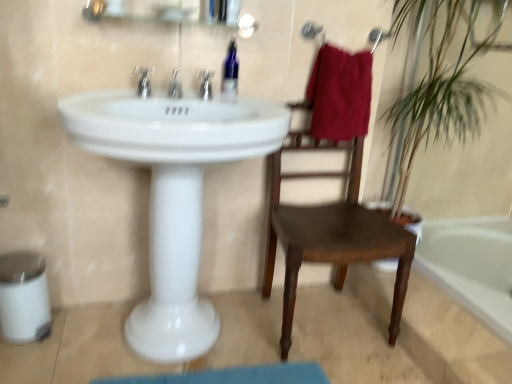
Locate an element on the screen. blue glossy bottle at upper center is located at coordinates (230, 74).

I want to click on burgundy cotton towel at upper right, so click(x=340, y=94).

Image resolution: width=512 pixels, height=384 pixels. Find the location of `white glossy bathtub at lower right`. white glossy bathtub at lower right is located at coordinates (472, 266).

What is the approximate height of green leafy plant at right?

It is 1.08 meters.

This screenshot has width=512, height=384. Describe the element at coordinates (331, 233) in the screenshot. I see `brown wooden chair at center` at that location.

Find the location of a particular element. The height and width of the screenshot is (384, 512). brown wooden chair at center is located at coordinates (331, 233).

What do you see at coordinates (144, 81) in the screenshot? I see `silver metallic faucet at upper center, acting as the 3th tap starting from the right` at bounding box center [144, 81].

Where is `blue glossy bottle at upper center`? blue glossy bottle at upper center is located at coordinates (230, 74).

From the image's perspective, is white glossy bathtub at lower right over brown wooden chair at center?

Actually, white glossy bathtub at lower right appears below brown wooden chair at center in the image.

What are the coordinates of `chair above the white glossy bathtub at lower right (from a real-world perspective)` in the screenshot? It's located at (331, 233).

Would you say white glossy bathtub at lower right contains brown wooden chair at center?

Actually, brown wooden chair at center is outside white glossy bathtub at lower right.

Looking at this image, based on their sizes in the image, would you say white glossy bathtub at lower right is bigger or smaller than brown wooden chair at center?

white glossy bathtub at lower right is smaller than brown wooden chair at center.

Considering the sizes of objects white glossy sink at center and metallic glass medicine cabinet at upper center in the image provided, who is thinner, white glossy sink at center or metallic glass medicine cabinet at upper center?

metallic glass medicine cabinet at upper center is thinner.

Is white glossy sink at center taller or shorter than metallic glass medicine cabinet at upper center?

In the image, white glossy sink at center appears to be taller than metallic glass medicine cabinet at upper center.

From the image's perspective, between white glossy sink at center and metallic glass medicine cabinet at upper center, which one is located above?

From the image's view, metallic glass medicine cabinet at upper center is above.

At what (x,y) coordinates should I click in order to perform the action: click on medicine cabinet on the left of white glossy sink at center. Please return your answer as a coordinate pair (x, y). This screenshot has width=512, height=384. Looking at the image, I should click on [x=166, y=10].

Is point (492, 329) positioned behind point (236, 3)?

Yes, point (492, 329) is farther from viewer.

Who is smaller, white glossy bathtub at lower right or metallic glass medicine cabinet at upper center?

metallic glass medicine cabinet at upper center is smaller.

Is white glossy bathtub at lower right aimed at metallic glass medicine cabinet at upper center?

No, white glossy bathtub at lower right is not turned towards metallic glass medicine cabinet at upper center.

What's the angular difference between white glossy bathtub at lower right and metallic glass medicine cabinet at upper center's facing directions?

The angular difference between white glossy bathtub at lower right and metallic glass medicine cabinet at upper center is 89.4 degrees.

At what (x,y) coordinates should I click in order to perform the action: click on beach towel behind the green leafy plant at right. Please return your answer as a coordinate pair (x, y). The width and height of the screenshot is (512, 384). Looking at the image, I should click on (340, 94).

From a real-world perspective, is green leafy plant at right positioned above or below burgundy cotton towel at upper right?

green leafy plant at right is situated lower than burgundy cotton towel at upper right in the real world.

Would you say green leafy plant at right is inside or outside burgundy cotton towel at upper right?

green leafy plant at right lies outside burgundy cotton towel at upper right.

From the image's perspective, is green leafy plant at right above burgundy cotton towel at upper right?

No.

From a real-world perspective, count 1st taps upward from the green leafy plant at right and point to it. Please provide its 2D coordinates.

[(175, 87)]

From the image's perspective, is green leafy plant at right under silver metallic tap at center, positioned as the second tap in right-to-left order?

Yes, from the image's perspective, green leafy plant at right is beneath silver metallic tap at center, positioned as the second tap in right-to-left order.

Consider the image. Does green leafy plant at right have a greater height compared to silver metallic tap at center, positioned as the second tap in right-to-left order?

Yes.

Does point (322, 95) lie in front of point (177, 83)?

That is False.

You are a GUI agent. You are given a task and a screenshot of the screen. Output one action in this format:
    pyautogui.click(x=<x>, y=<y>)
    Task: Click on the beach towel behind the silver metallic tap at center, the 2th tap positioned from the left
    This screenshot has height=384, width=512.
    Given the screenshot: What is the action you would take?
    pyautogui.click(x=340, y=94)

Can you tell me how much burgundy cotton towel at upper right and silver metallic tap at center, positioned as the second tap in right-to-left order, differ in facing direction?

burgundy cotton towel at upper right and silver metallic tap at center, positioned as the second tap in right-to-left order, are facing 0.978 degrees away from each other.

Considering the points (508, 219) and (176, 74), which point is in front, point (508, 219) or point (176, 74)?

The point (176, 74) is closer to the camera.

Which object is more forward, white glossy bathtub at lower right or silver metallic tap at center, positioned as the second tap in right-to-left order?

silver metallic tap at center, positioned as the second tap in right-to-left order.

Is white glossy bathtub at lower right facing away from silver metallic tap at center, positioned as the second tap in right-to-left order?

No, white glossy bathtub at lower right's orientation is not away from silver metallic tap at center, positioned as the second tap in right-to-left order.

Which of these two, white glossy bathtub at lower right or silver metallic tap at center, positioned as the second tap in right-to-left order, is bigger?

white glossy bathtub at lower right is bigger.

I want to click on chair lying above the white glossy bathtub at lower right (from the image's perspective), so click(331, 233).

This screenshot has height=384, width=512. Find the location of `sink that is on the right side of metallic glass medicine cabinet at upper center`. sink that is on the right side of metallic glass medicine cabinet at upper center is located at coordinates (173, 195).

Considering their positions, is silver metallic tap at center, positioned as the second tap in right-to-left order, positioned further to brown wooden chair at center than burgundy cotton towel at upper right?

The object further to brown wooden chair at center is silver metallic tap at center, positioned as the second tap in right-to-left order.

Considering their positions, is metallic glass medicine cabinet at upper center positioned closer to brown wooden chair at center than green leafy plant at right?

The object closer to brown wooden chair at center is green leafy plant at right.

Based on their spatial positions, is white glossy sink at center or burgundy cotton towel at upper right closer to silver metallic faucet at upper center, positioned as the first tap in left-to-right order?

Among the two, white glossy sink at center is located nearer to silver metallic faucet at upper center, positioned as the first tap in left-to-right order.

From the image, which object appears to be farther from metallic glass medicine cabinet at upper center, white glossy bathtub at lower right or white glossy sink at center?

Among the two, white glossy bathtub at lower right is located further to metallic glass medicine cabinet at upper center.

From the image, which object appears to be nearer to brown wooden chair at center, matte silver faucet at center, which is the 1th tap in right-to-left order, or white glossy sink at center?

white glossy sink at center is closer to brown wooden chair at center.

From the picture: From the image, which object appears to be farther from white glossy bathtub at lower right, silver metallic faucet at upper center, positioned as the first tap in left-to-right order, or matte silver faucet at center, which is the 1th tap in right-to-left order?

silver metallic faucet at upper center, positioned as the first tap in left-to-right order.

Considering their positions, is silver metallic tap at center, the 2th tap positioned from the left, positioned closer to blue glossy bottle at upper center than white glossy sink at center?

The object closer to blue glossy bottle at upper center is silver metallic tap at center, the 2th tap positioned from the left.

From the picture: Based on their spatial positions, is silver metallic faucet at upper center, acting as the 3th tap starting from the right, or silver metallic tap at center, positioned as the second tap in right-to-left order, further from white glossy sink at center?

The object further to white glossy sink at center is silver metallic faucet at upper center, acting as the 3th tap starting from the right.

At what (x,y) coordinates should I click in order to perform the action: click on toiletry between metallic glass medicine cabinet at upper center and green leafy plant at right in the horizontal direction. Please return your answer as a coordinate pair (x, y). Looking at the image, I should click on (230, 74).

Image resolution: width=512 pixels, height=384 pixels. I want to click on beach towel between silver metallic tap at center, positioned as the second tap in right-to-left order, and green leafy plant at right, so click(340, 94).

Identify the location of toiletry located between silver metallic faucet at upper center, positioned as the first tap in left-to-right order, and white glossy bathtub at lower right in the left-right direction. The width and height of the screenshot is (512, 384). (230, 74).

You are a GUI agent. You are given a task and a screenshot of the screen. Output one action in this format:
    pyautogui.click(x=<x>, y=<y>)
    Task: Click on the chair located between silver metallic tap at center, the 2th tap positioned from the left, and green leafy plant at right in the left-right direction
    This screenshot has width=512, height=384.
    Given the screenshot: What is the action you would take?
    pyautogui.click(x=331, y=233)